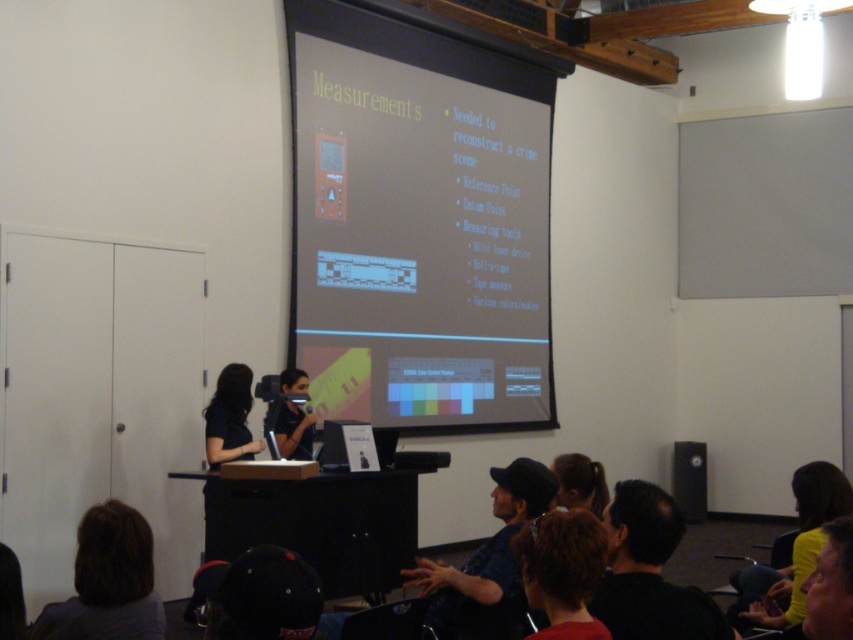
You are a student sitting at the back of the classroom and want to see both the dark blue denim jacket at lower center and the smooth red shirt at lower center. Which one is positioned lower in the image?

The dark blue denim jacket at lower center is located below the smooth red shirt at lower center, so the dark blue denim jacket at lower center is positioned lower in the image.

You are a student sitting in the classroom and want to see both the black matte hair at lower right and the black matte shirt at center clearly. Which one appears closer to you?

The black matte hair at lower right is closer to the viewer than the black matte shirt at center, so it appears closer to you.